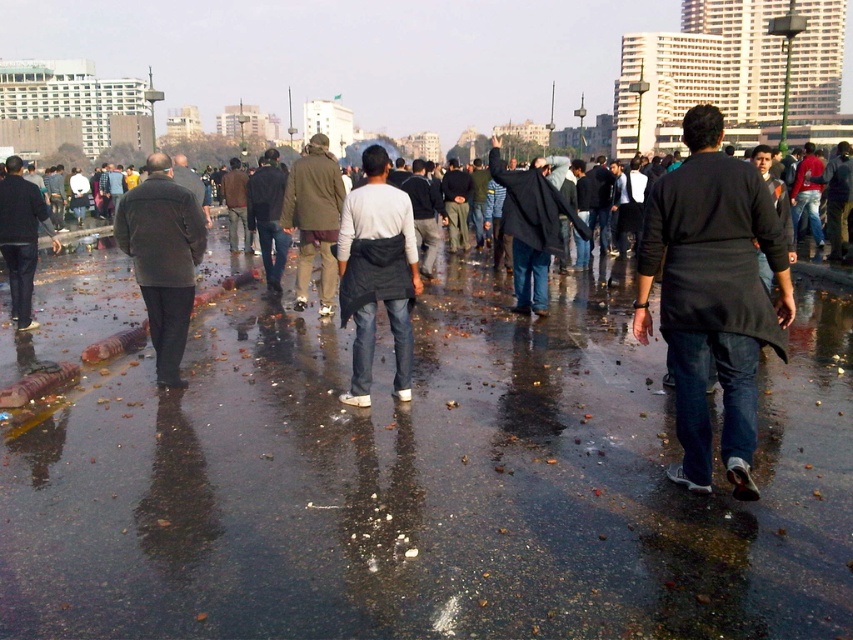
Who is taller, dark gray coat at center or brown woolen jacket at center?

dark gray coat at center

Does dark gray coat at center have a greater height compared to brown woolen jacket at center?

Correct, dark gray coat at center is much taller as brown woolen jacket at center.

The width and height of the screenshot is (853, 640). What are the coordinates of `dark gray coat at center` in the screenshot? It's located at (531, 227).

Is dark gray wool coat at center closer to camera compared to brown woolen jacket at center?

Yes, it is.

Identify the location of dark gray wool coat at center. This screenshot has width=853, height=640. (161, 259).

This screenshot has width=853, height=640. What are the coordinates of `dark gray wool coat at center` in the screenshot? It's located at (161, 259).

Is dark gray wool coat at center behind dark gray coat at center?

That is False.

Based on the photo, which is below, dark gray wool coat at center or dark gray coat at center?

dark gray wool coat at center is lower down.

In order to click on dark gray wool coat at center in this screenshot , I will do `click(161, 259)`.